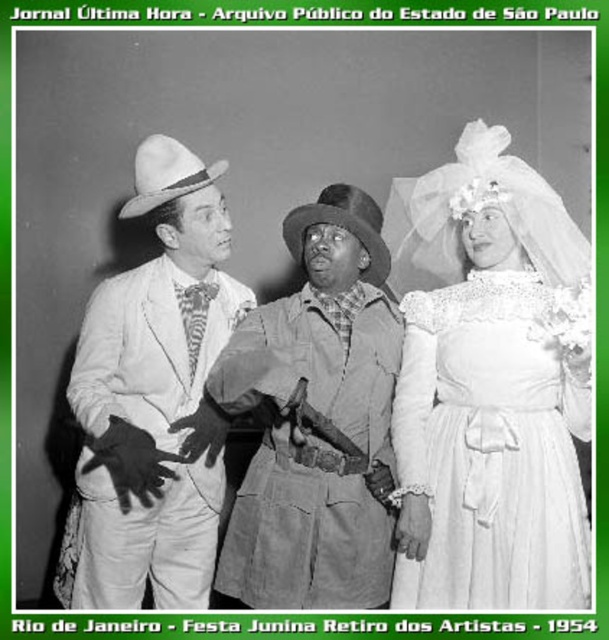
Is matte white dress at center behind leather jacket at center?

No, it is not.

Does matte white dress at center have a larger size compared to leather jacket at center?

Indeed, matte white dress at center has a larger size compared to leather jacket at center.

Image resolution: width=609 pixels, height=640 pixels. What do you see at coordinates (491, 388) in the screenshot?
I see `matte white dress at center` at bounding box center [491, 388].

At what (x,y) coordinates should I click in order to perform the action: click on matte white dress at center. Please return your answer as a coordinate pair (x, y). Looking at the image, I should click on (491, 388).

The height and width of the screenshot is (640, 609). I want to click on matte white dress at center, so click(491, 388).

Does white lace dress at right have a greater height compared to leather jacket at center?

No.

Can you confirm if white lace dress at right is positioned to the right of leather jacket at center?

Correct, you'll find white lace dress at right to the right of leather jacket at center.

Does point (526, 349) lie behind point (276, 592)?

No, (526, 349) is closer to viewer.

Find the location of a particular element. white lace dress at right is located at coordinates (495, 444).